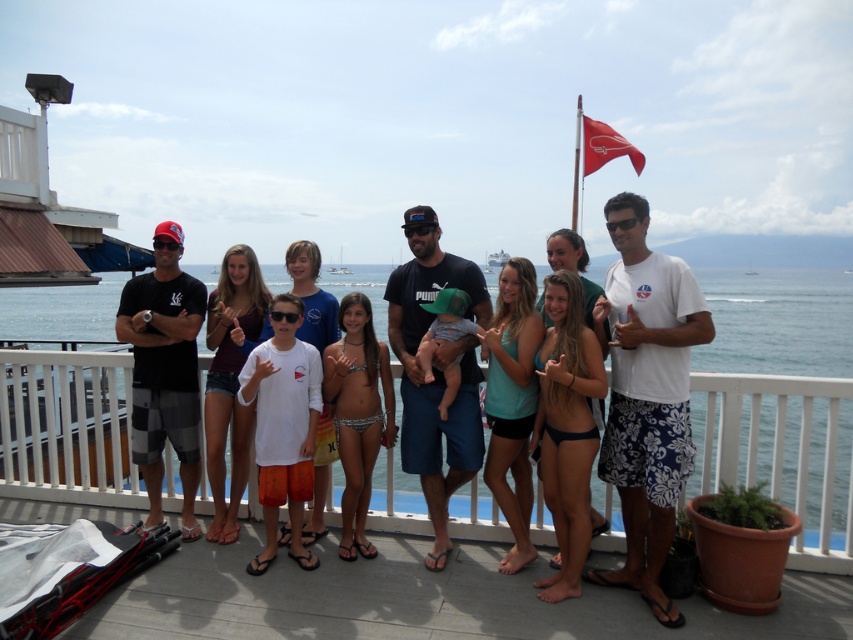
You are standing on the deck and want to take a photo of both the point at coordinates [219,438] and the point at coordinates [622,147]. Which point will appear larger in the photo?

Point at coordinates [219,438] will appear larger in the photo because it is closer to the camera than point at coordinates [622,147].

You are a photographer standing at the edge of the deck. You want to ensure that the subject wearing the white matte shirt at center is in focus while the background remains slightly blurred. Given that your camera has a depth of field setting that can blur objects beyond a certain distance, what is the minimum distance in feet that you should set the blur threshold to achieve this effect?

The white matte shirt at center is 13.98 feet away from the camera. To keep it in focus and blur the background, the blur threshold should be set just beyond 13.98 feet, ensuring the subject remains sharp while objects farther away become blurred.

In the photo, there are two items of interest on the deck. The maroon jersey at center and the red fabric flag at upper center. Which one is positioned to the left when viewed from the front of the deck?

The maroon jersey at center is to the left of the red fabric flag at upper center.